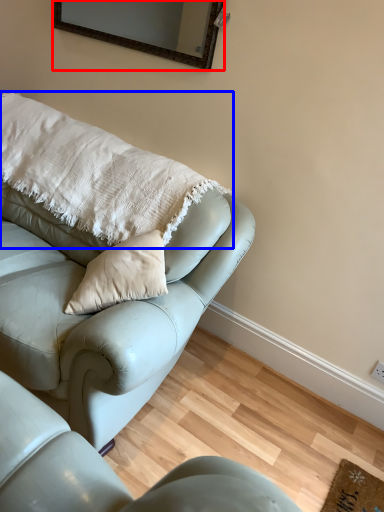
Question: Which point is further to the camera, mirror (highlighted by a red box) or pillow (highlighted by a blue box)?

Choices:
 (A) mirror
 (B) pillow

Answer: (A)